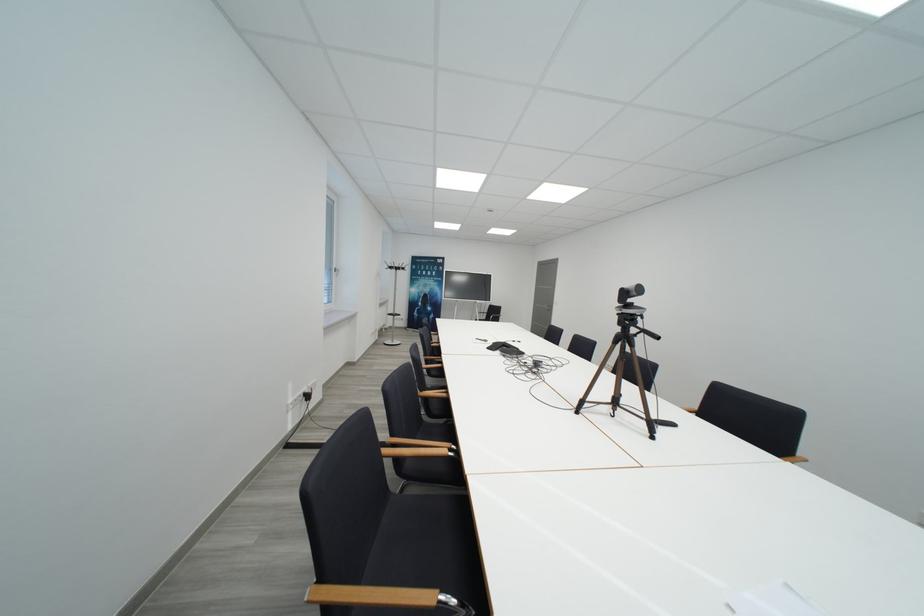
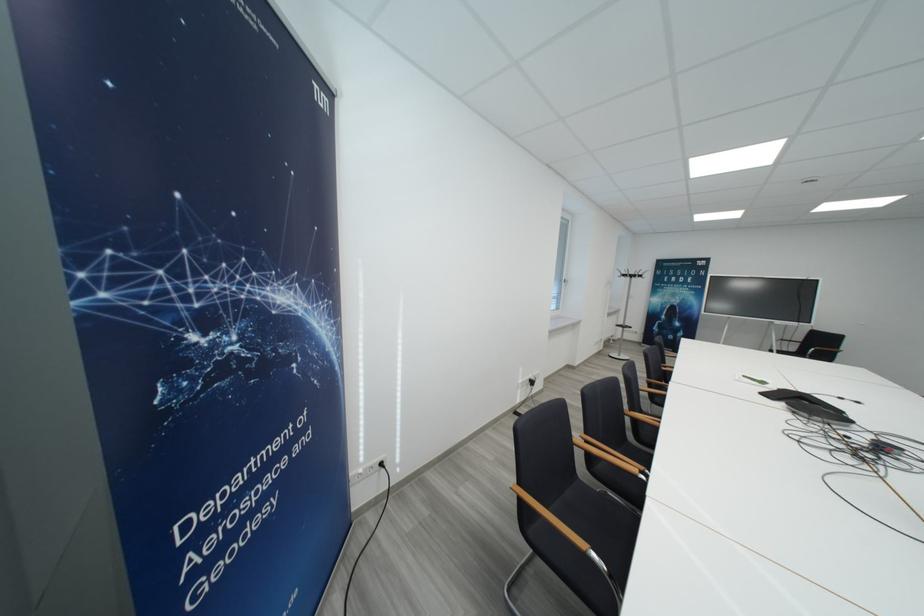
Locate, in the second image, the point that corresponds to (x=397, y=270) in the first image.

(631, 278)